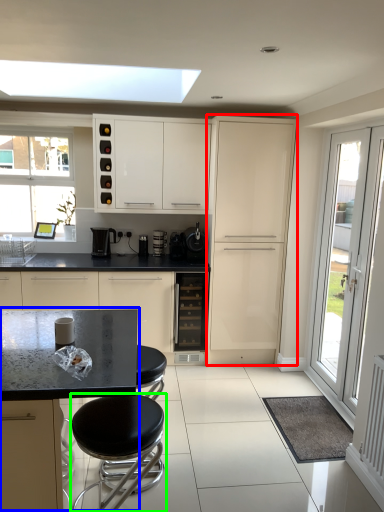
Question: Estimate the real-world distances between objects in this image. Which object is farther from cabinetry (highlighted by a red box), round table (highlighted by a blue box) or stool (highlighted by a green box)?

Choices:
 (A) round table
 (B) stool

Answer: (B)